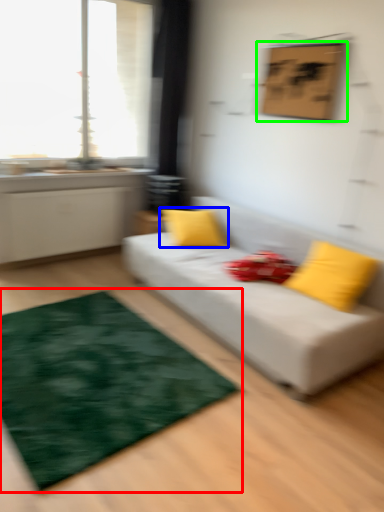
Question: Based on their relative distances, which object is nearer to mat (highlighted by a red box)? Choose from pillow (highlighted by a blue box) and picture frame (highlighted by a green box).

Choices:
 (A) pillow
 (B) picture frame

Answer: (A)